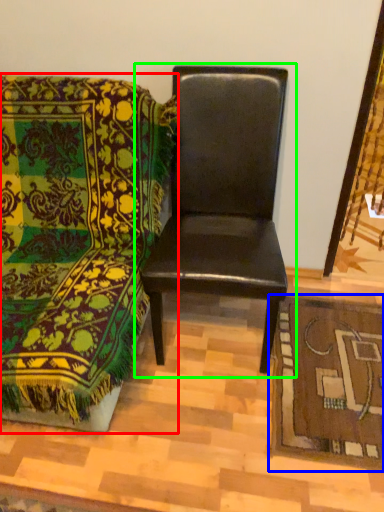
Question: Which object is the farthest from chair (highlighted by a red box)? Choose among these: mat (highlighted by a blue box) or chair (highlighted by a green box).

Choices:
 (A) mat
 (B) chair

Answer: (A)